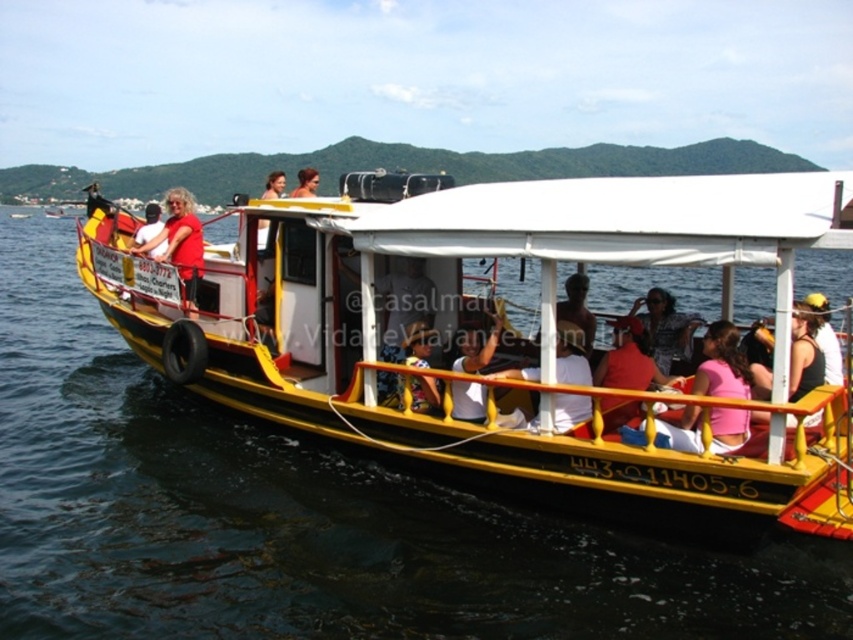
Question: Does yellow matte boat at center appear over matte red shirt at left?

Choices:
 (A) yes
 (B) no

Answer: (B)

Question: Does yellow matte boat at center have a lesser width compared to matte red shirt at left?

Choices:
 (A) yes
 (B) no

Answer: (A)

Question: Is yellow matte boat at center below matte red shirt at left?

Choices:
 (A) yes
 (B) no

Answer: (A)

Question: Which point appears closest to the camera in this image?

Choices:
 (A) (677, 480)
 (B) (186, 307)

Answer: (A)

Question: Which point appears farthest from the camera in this image?

Choices:
 (A) (714, 426)
 (B) (178, 227)

Answer: (B)